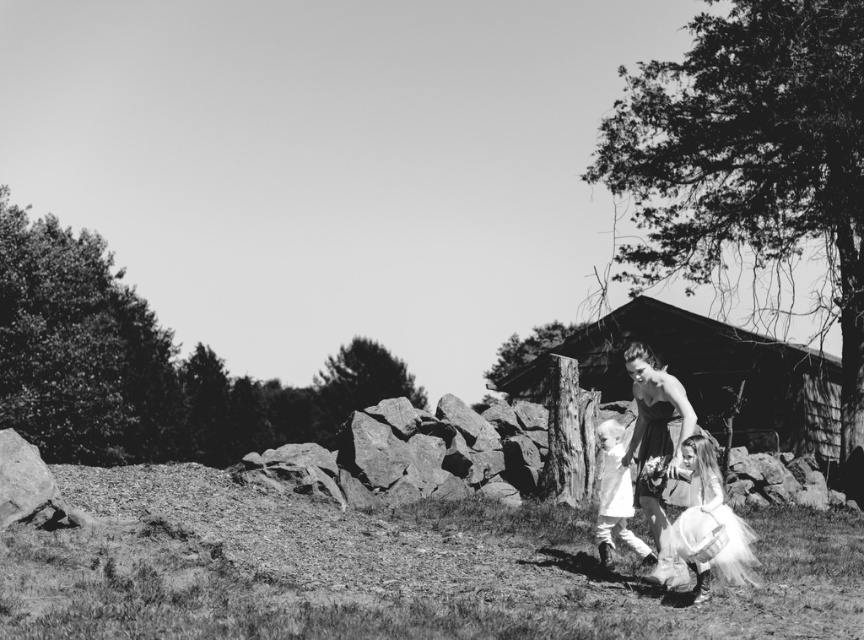
Based on the photo, you are a photographer planning to take a portrait of two people wearing the matte black dress at center and the white tulle dress at lower right. Based on the scene described, which dress will appear taller in the final photograph?

The matte black dress at center will appear taller in the final photograph because it has a greater height compared to the white tulle dress at lower right.

You are standing in the scene and want to touch both the white tulle dress at lower right and the white soft dress at center. Which dress should you reach for first to touch the one closer to you?

You should first touch the white tulle dress at lower right because it is closer to the viewer than the white soft dress at center.

From the picture: You are standing at the point with coordinates point (706, 376). What is the object you are standing on?

The point (706, 376) is on wooden hut at center.